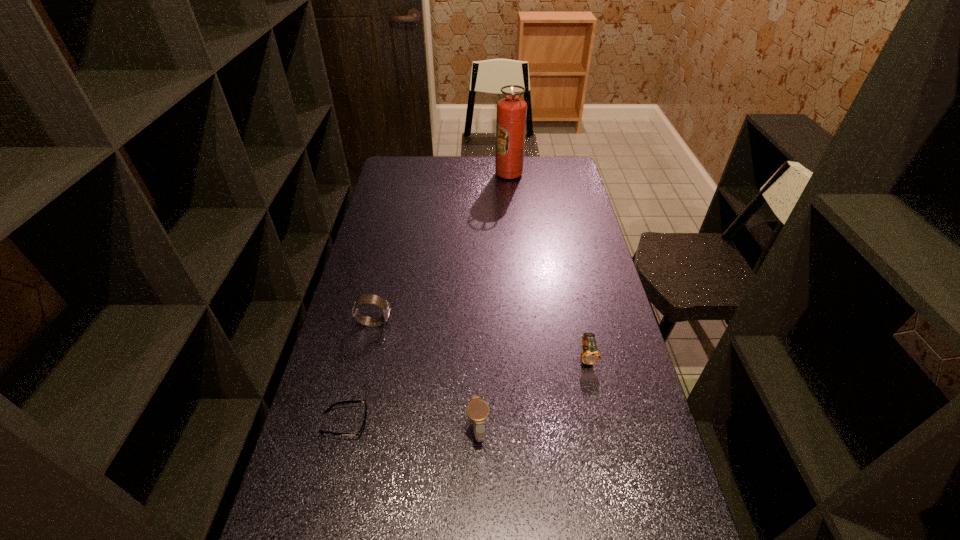
Where is `free region located 0.300m on the label side of the tallest object`? Image resolution: width=960 pixels, height=540 pixels. free region located 0.300m on the label side of the tallest object is located at coordinates (432, 174).

The width and height of the screenshot is (960, 540). I want to click on free spot located on the label side of the tallest object, so click(468, 174).

Where is `vacant space located 0.140m on the face of the leftmost watch`? vacant space located 0.140m on the face of the leftmost watch is located at coordinates (435, 322).

Find the location of a particular element. vacant space located on the right of the nearest watch is located at coordinates coord(583,429).

Where is `free location located on the face of the third nearest object`? The width and height of the screenshot is (960, 540). free location located on the face of the third nearest object is located at coordinates (598, 409).

The image size is (960, 540). I want to click on free point located on the front-facing side of the sunglasses, so click(x=436, y=423).

This screenshot has height=540, width=960. In order to click on object present at the far edge in this screenshot , I will do `click(511, 111)`.

Identify the location of watch that is at the left edge. This screenshot has width=960, height=540. (368, 298).

This screenshot has width=960, height=540. In order to click on sunglasses present at the left edge in this screenshot , I will do `click(360, 432)`.

Find the location of a particular element. object at the right edge is located at coordinates (590, 355).